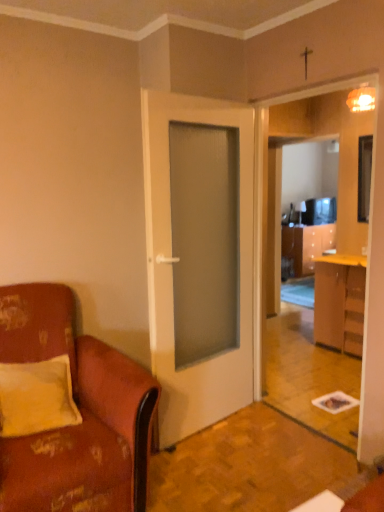
Question: Considering the relative sizes of black glossy television at right and white matte door at center in the image provided, is black glossy television at right bigger than white matte door at center?

Choices:
 (A) no
 (B) yes

Answer: (A)

Question: Does black glossy television at right have a greater width compared to white matte door at center?

Choices:
 (A) yes
 (B) no

Answer: (B)

Question: From the image's perspective, is black glossy television at right under white matte door at center?

Choices:
 (A) no
 (B) yes

Answer: (A)

Question: Is black glossy television at right placed right next to white matte door at center?

Choices:
 (A) yes
 (B) no

Answer: (B)

Question: Is white matte door at center surrounded by black glossy television at right?

Choices:
 (A) yes
 (B) no

Answer: (B)

Question: Is point pyautogui.click(x=89, y=382) positioned closer to the camera than point pyautogui.click(x=364, y=281)?

Choices:
 (A) closer
 (B) farther

Answer: (A)

Question: Is leather at left taller or shorter than wooden cabinet at right?

Choices:
 (A) tall
 (B) short

Answer: (A)

Question: From the image's perspective, is leather at left located above or below wooden cabinet at right?

Choices:
 (A) above
 (B) below

Answer: (B)

Question: Is leather at left spatially inside wooden cabinet at right, or outside of it?

Choices:
 (A) inside
 (B) outside

Answer: (B)

Question: Is black glossy television at right taller or shorter than leather at left?

Choices:
 (A) tall
 (B) short

Answer: (B)

Question: Considering the positions of point (370, 167) and point (56, 338), is point (370, 167) closer or farther from the camera than point (56, 338)?

Choices:
 (A) farther
 (B) closer

Answer: (A)

Question: Visually, is black glossy television at right positioned to the left or to the right of leather at left?

Choices:
 (A) left
 (B) right

Answer: (B)

Question: In terms of size, does black glossy television at right appear bigger or smaller than leather at left?

Choices:
 (A) small
 (B) big

Answer: (A)

Question: Considering the positions of white matte door at center and wooden cabinet at right in the image, is white matte door at center taller or shorter than wooden cabinet at right?

Choices:
 (A) short
 (B) tall

Answer: (B)

Question: Is white matte door at center to the left or to the right of wooden cabinet at right in the image?

Choices:
 (A) right
 (B) left

Answer: (B)